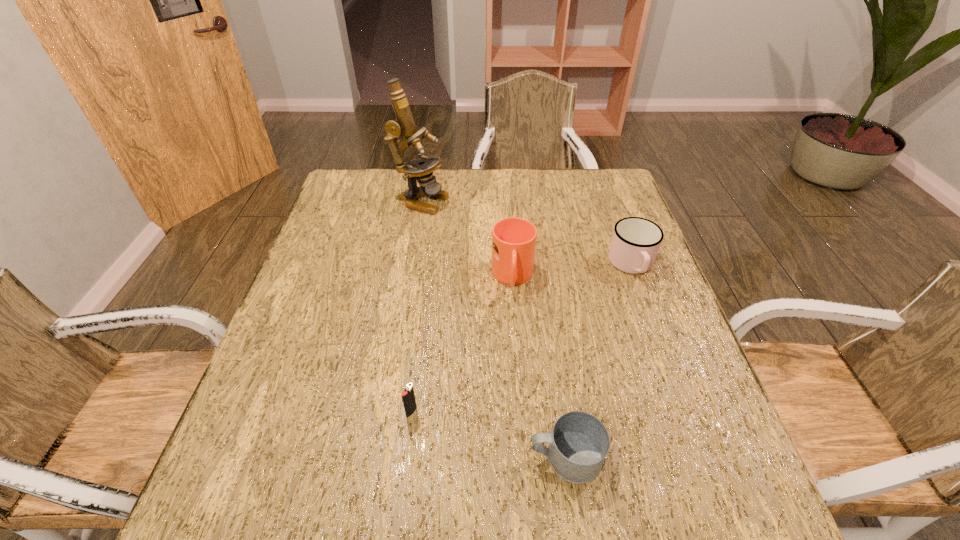
The image size is (960, 540). In order to click on free space located 0.110m on the side of the rightmost object with the handle in this screenshot , I will do `click(652, 319)`.

Identify the location of free region located 0.340m on the back of the igniter. The image size is (960, 540). (427, 285).

Locate an element on the screen. vacant area located on the side of the nearest object with the handle is located at coordinates (342, 457).

Locate an element on the screen. This screenshot has height=540, width=960. vacant region located on the side of the nearest object with the handle is located at coordinates (424, 457).

This screenshot has height=540, width=960. Find the location of `free space located 0.140m on the side of the nearest object with the handle`. free space located 0.140m on the side of the nearest object with the handle is located at coordinates (452, 457).

Where is `object that is positioned at the far edge`? This screenshot has height=540, width=960. object that is positioned at the far edge is located at coordinates (421, 169).

Locate an element on the screen. Image resolution: width=960 pixels, height=540 pixels. object located in the right edge section of the desktop is located at coordinates (635, 243).

Locate an element on the screen. This screenshot has width=960, height=540. vacant position at the far edge of the desktop is located at coordinates (469, 184).

Locate an element on the screen. vacant region at the near edge of the desktop is located at coordinates (457, 492).

The height and width of the screenshot is (540, 960). What are the coordinates of `free space at the left edge` in the screenshot? It's located at (353, 264).